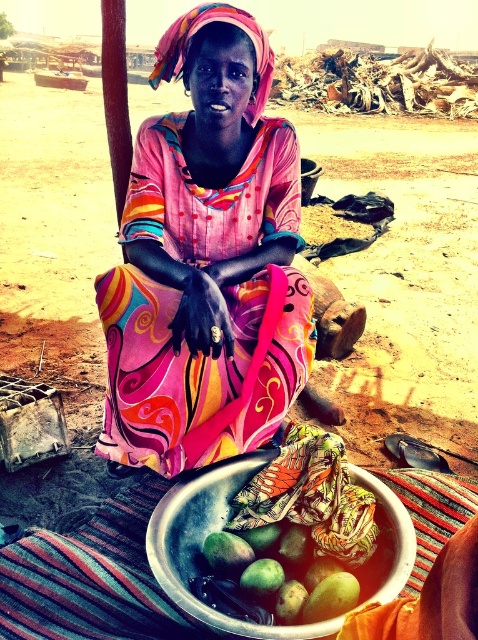
Please describe the position of the metallic silver bowl at lower center in terms of coordinates within the image frame. The image frame is normalized to a coordinate system where the bottom left corner is at position 0,0 and the top right corner is at position 1,1. The coordinates are given as x,y where x is the horizontal axis from left to right and y is the vertical axis from bottom to top. Please provide the coordinates as a point in the form of a tuple like this example format for your answer, e.g., 0.

The metallic silver bowl at lower center is located at coordinates (201, 547).

You are standing in front of the woman and want to place a small object between the two points, point (x=195, y=294) and point (x=284, y=554). Which point is closer to you so you can place the object there first?

Point (x=195, y=294) is closer to you than point (x=284, y=554), so you should place the object near point (x=195, y=294) first.

Where is the matte pink dress at center located in the image?

The matte pink dress at center is located at point (x=206, y=260).